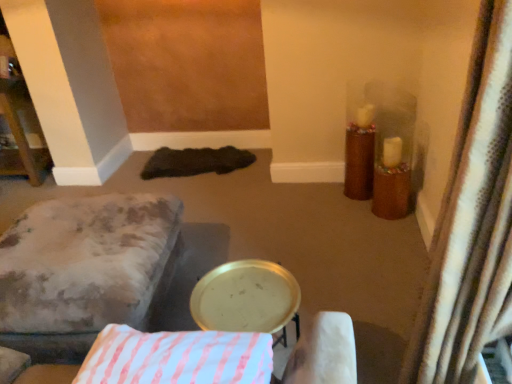
I want to click on vacant space situated above velvet-like beige ottoman at lower left (from a real-world perspective), so click(x=53, y=239).